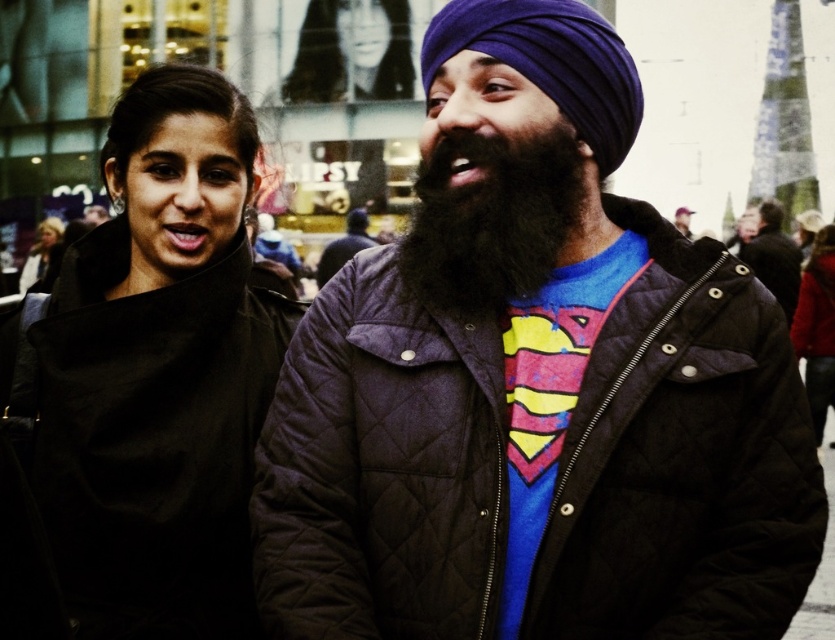
You are a photographer setting up a shot of the two people in the image. You want to ensure that the black matte coat at center and the smooth black hair at upper center are both clearly visible in the frame. Based on their positions, which object should you focus on first to ensure both are in focus?

The black matte coat at center is positioned under smooth black hair at upper center. To ensure both are in focus, you should focus on the smooth black hair at upper center first since it is higher up, allowing the coat below to stay in the same focal plane.

You are standing in the middle of the image and want to locate the black matte coat at center. In which direction should you look to find it?

The black matte coat at center is located at point 0.605 on the x axis and 0.172 on the y axis. Since you are standing in the middle of the image, you should look to the right and slightly downward to find the black matte coat at center.

You are a photographer trying to capture a closeup of the purple fabric turban at upper center and the black quilted jacket at center. Since you want to focus on both, which object should you zoom in on to ensure both are in frame without cropping?

The purple fabric turban at upper center is wider than the black quilted jacket at center, so you should zoom in on the purple fabric turban at upper center to ensure both are in frame without cropping.